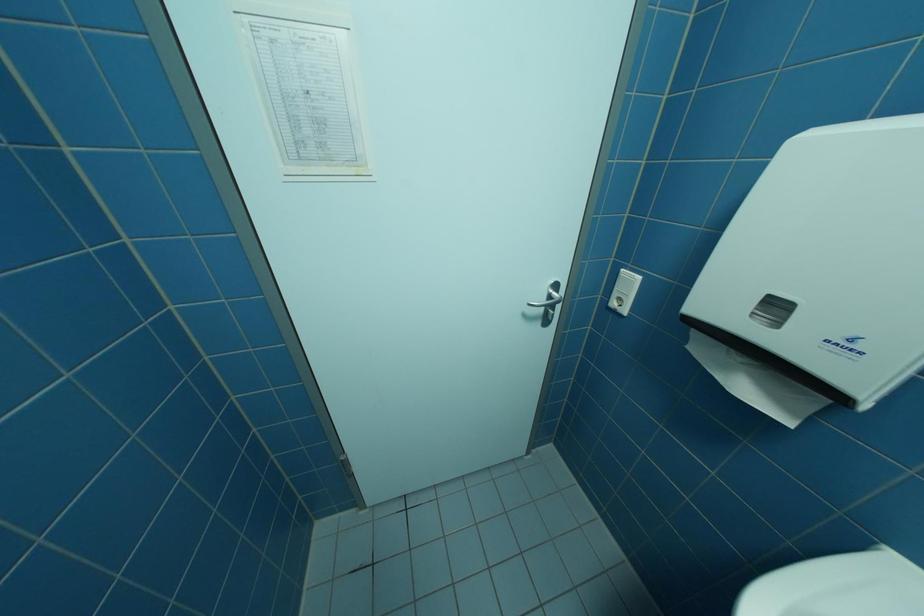
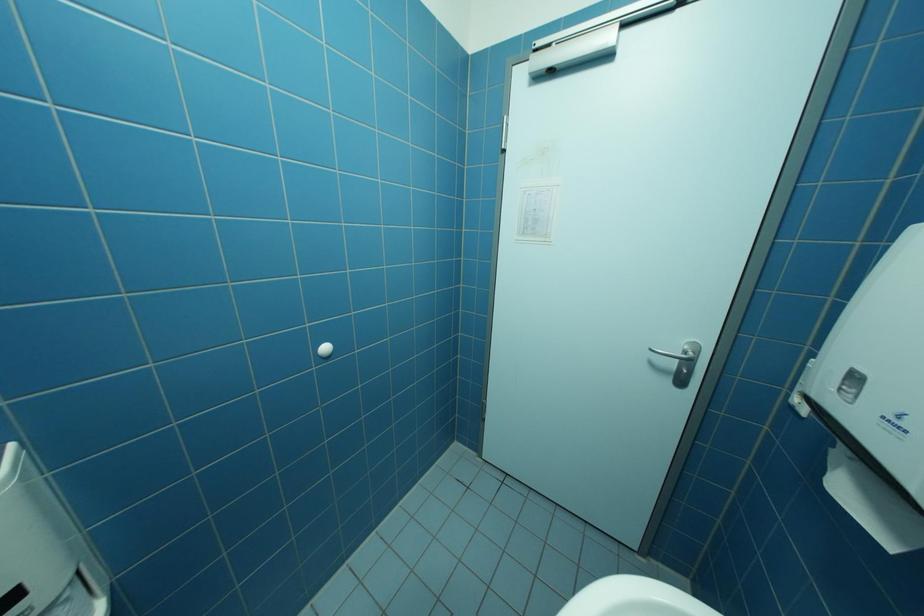
Question: Based on the continuous images, in which direction is the camera rotating? Reply with the corresponding letter.

Choices:
 (A) Left
 (B) Right
 (C) Up
 (D) Down

Answer: (A)